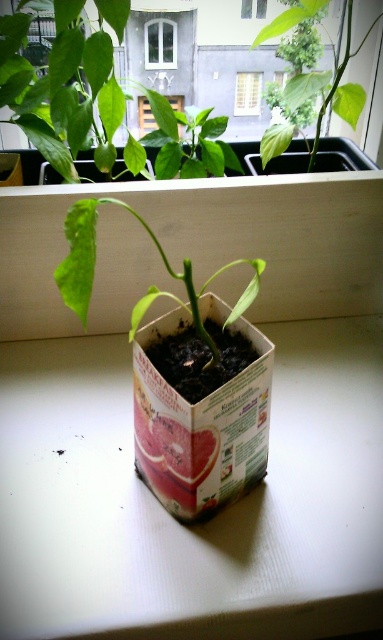
You are a gardener looking at the scene. You need to determine which object occupies more space in the image. Based on the provided information, which is larger in size between the green matte plant at center and the white plastic window at upper center?

The green matte plant at center is bigger than the white plastic window at upper center according to the description.

From the picture: Where is the green matte plant at center located in the image?

The green matte plant at center is located at point [150,285] in the image.